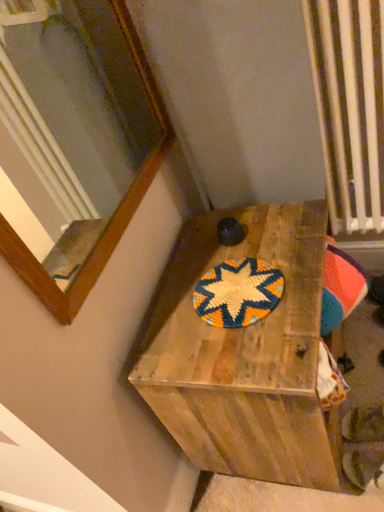
Identify the location of free location to the left of brightly woven mat at center. Image resolution: width=384 pixels, height=512 pixels. (171, 331).